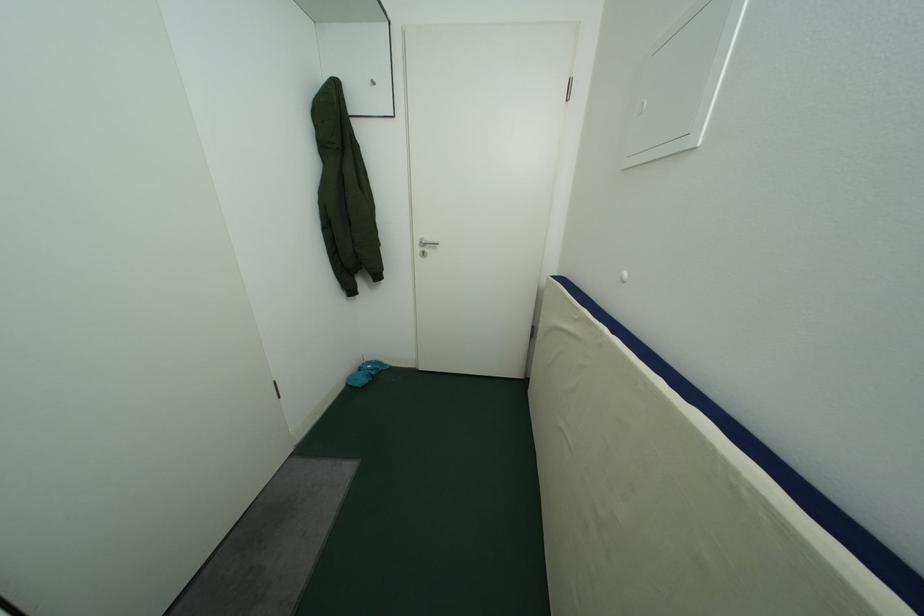
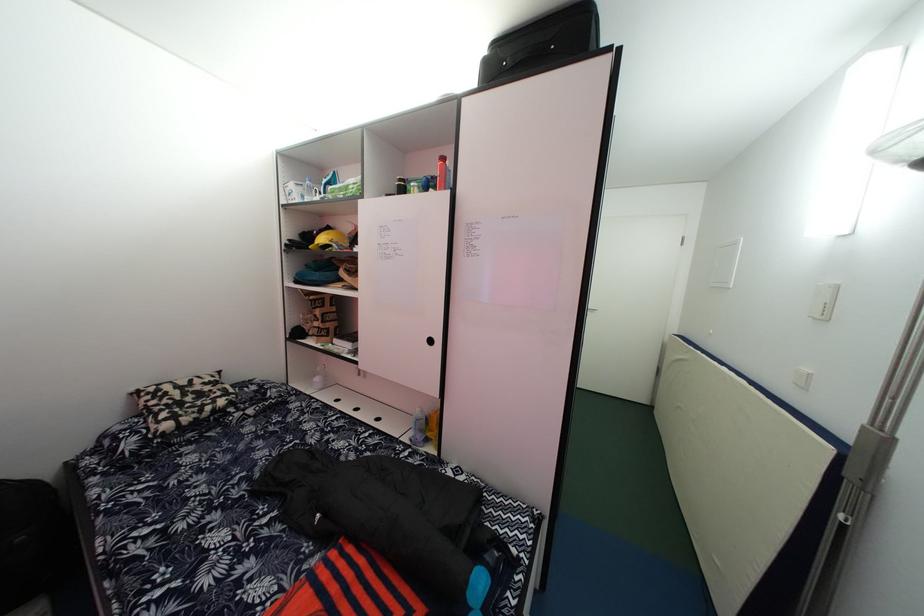
Question: Which direction would the cameraman need to move to produce the second image? Reply with the corresponding letter.

Choices:
 (A) Left
 (B) Right
 (C) Forward
 (D) Backward

Answer: (D)